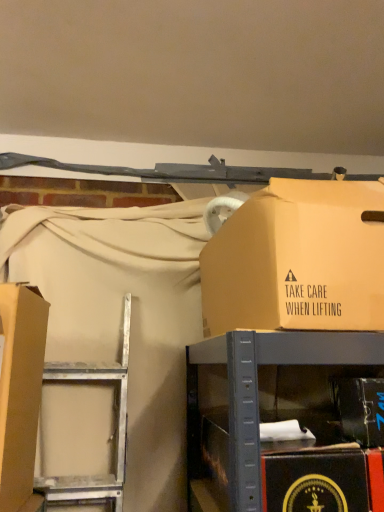
Question: Are matte cardboard box at left, arranged as the 3th box when viewed from the right, and matte cardboard box at upper right, the 2th box viewed from the right, making contact?

Choices:
 (A) yes
 (B) no

Answer: (B)

Question: Is matte cardboard box at left, arranged as the 3th box when viewed from the right, turned away from matte cardboard box at upper right, arranged as the second box when viewed from the left?

Choices:
 (A) yes
 (B) no

Answer: (B)

Question: Can you confirm if matte cardboard box at left, arranged as the 3th box when viewed from the right, is positioned to the right of matte cardboard box at upper right, arranged as the second box when viewed from the left?

Choices:
 (A) yes
 (B) no

Answer: (B)

Question: Can you confirm if matte cardboard box at left, acting as the first box starting from the left, is bigger than matte cardboard box at upper right, the 2th box viewed from the right?

Choices:
 (A) no
 (B) yes

Answer: (A)

Question: Could you tell me if matte cardboard box at left, arranged as the 3th box when viewed from the right, is facing matte cardboard box at upper right, arranged as the second box when viewed from the left?

Choices:
 (A) yes
 (B) no

Answer: (A)

Question: Is matte cardboard box at left, arranged as the 3th box when viewed from the right, smaller than matte cardboard box at upper right, arranged as the second box when viewed from the left?

Choices:
 (A) no
 (B) yes

Answer: (B)

Question: From the image's perspective, would you say matte cardboard box at left, arranged as the 3th box when viewed from the right, is shown under metallic cardboard box at center?

Choices:
 (A) yes
 (B) no

Answer: (B)

Question: Does matte cardboard box at left, acting as the first box starting from the left, turn towards metallic cardboard box at center?

Choices:
 (A) no
 (B) yes

Answer: (B)

Question: Can you confirm if matte cardboard box at left, acting as the first box starting from the left, is shorter than metallic cardboard box at center?

Choices:
 (A) yes
 (B) no

Answer: (B)

Question: Is matte cardboard box at left, acting as the first box starting from the left, smaller than metallic cardboard box at center?

Choices:
 (A) yes
 (B) no

Answer: (A)

Question: Is metallic cardboard box at center completely or partially inside matte cardboard box at left, arranged as the 3th box when viewed from the right?

Choices:
 (A) no
 (B) yes

Answer: (A)

Question: From a real-world perspective, is matte cardboard box at left, arranged as the 3th box when viewed from the right, located higher than metallic cardboard box at center?

Choices:
 (A) yes
 (B) no

Answer: (A)

Question: From the image's perspective, would you say metallic cardboard box at center is positioned over matte cardboard box at upper right, arranged as the second box when viewed from the left?

Choices:
 (A) no
 (B) yes

Answer: (A)